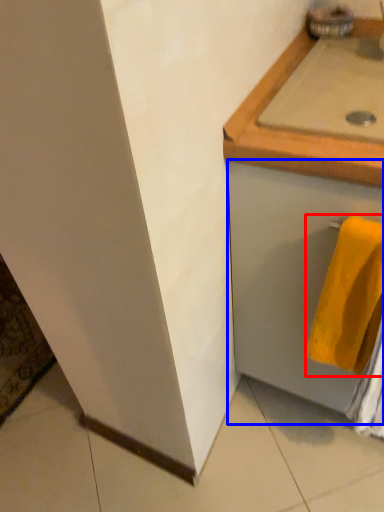
Question: Which object is closer to the camera taking this photo, towel (highlighted by a red box) or drawer (highlighted by a blue box)?

Choices:
 (A) towel
 (B) drawer

Answer: (B)